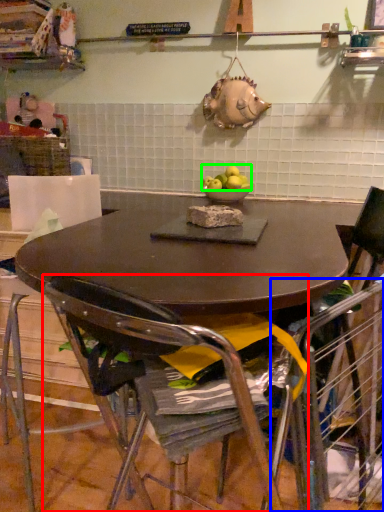
Question: Considering the real-world distances, which object is closest to chair (highlighted by a red box)? armchair (highlighted by a blue box) or apple (highlighted by a green box).

Choices:
 (A) armchair
 (B) apple

Answer: (A)